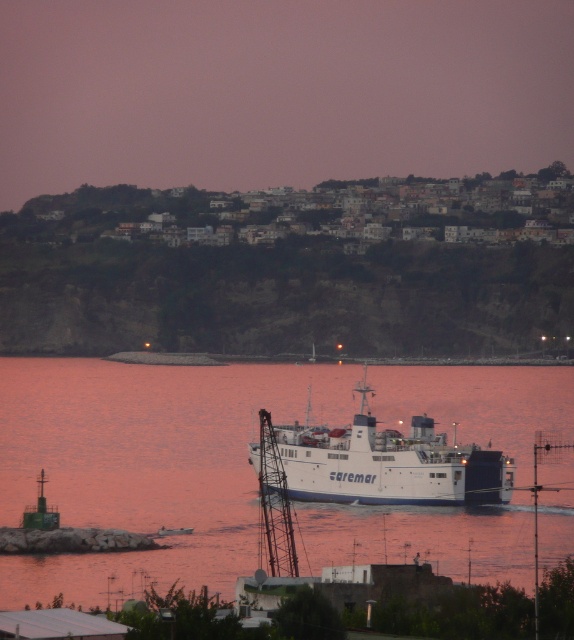
Is point (329, 368) positioned in front of point (444, 435)?

No, it is not.

Is white matte water at center further to camera compared to white matte ferry at center?

No, white matte water at center is closer to the viewer.

Is point (305, 573) positioned behind point (333, 444)?

No, (305, 573) is in front of (333, 444).

Locate an element on the screen. The image size is (574, 640). white matte water at center is located at coordinates (145, 464).